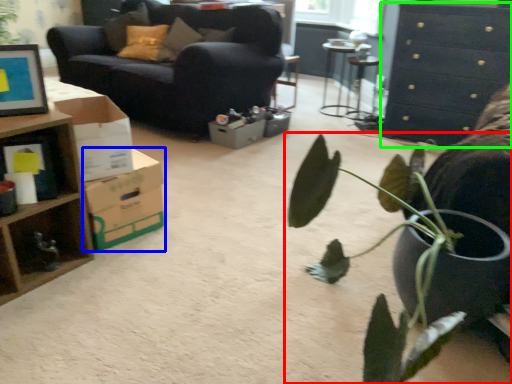
Question: Based on their relative distances, which object is nearer to houseplant (highlighted by a red box)? Choose from cardboard box (highlighted by a blue box) and chest of drawers (highlighted by a green box).

Choices:
 (A) cardboard box
 (B) chest of drawers

Answer: (A)